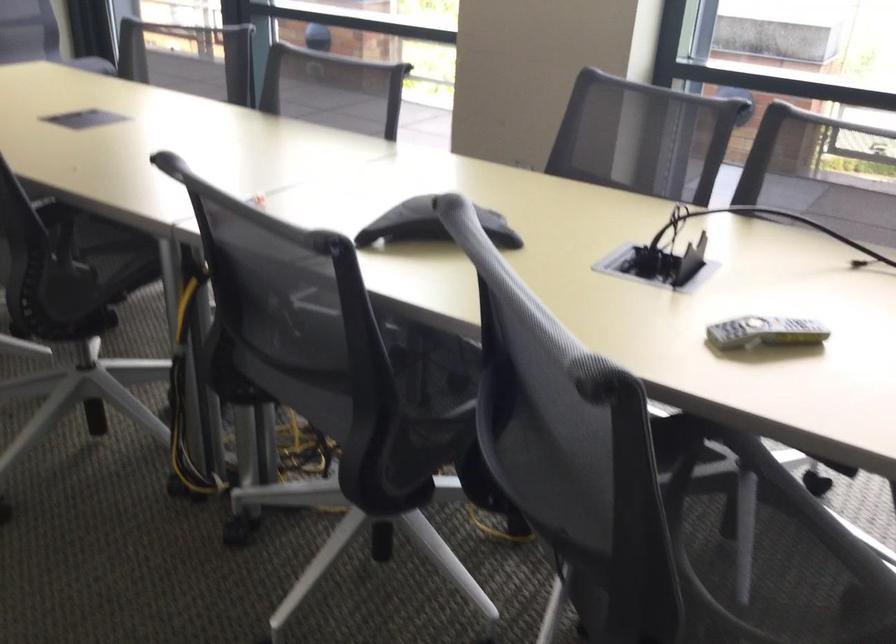
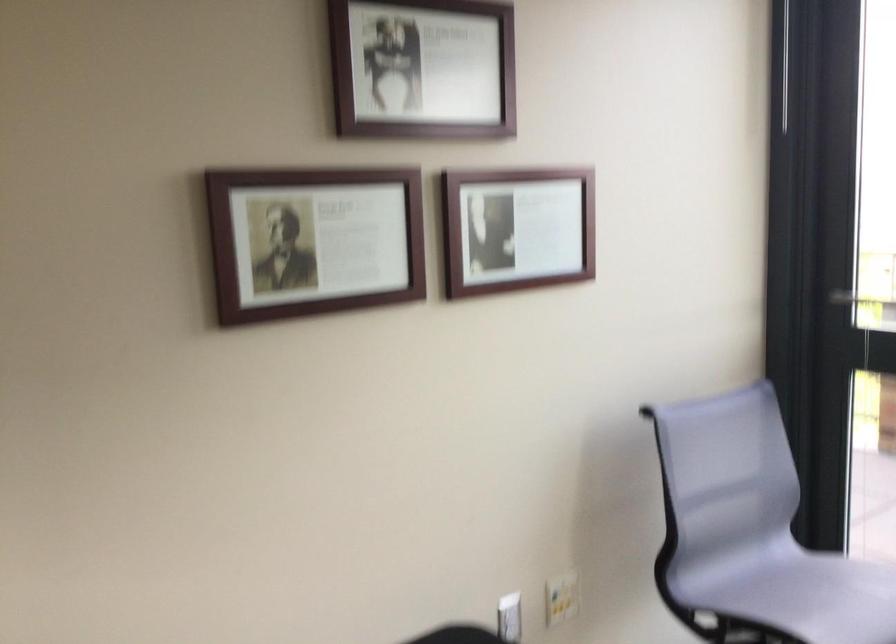
In a continuous first-person perspective shot, in which direction is the camera moving?

The cameraman walked toward left, forward.